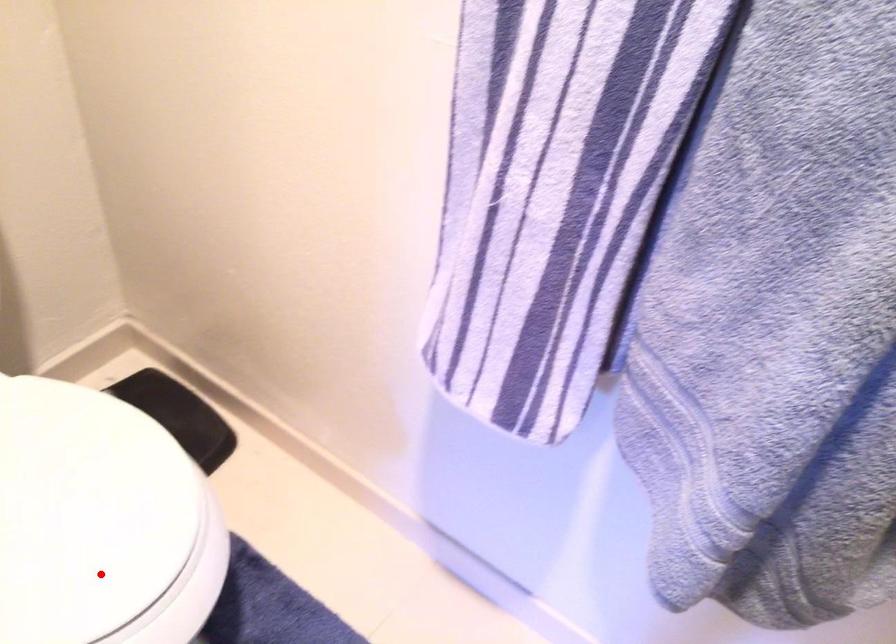
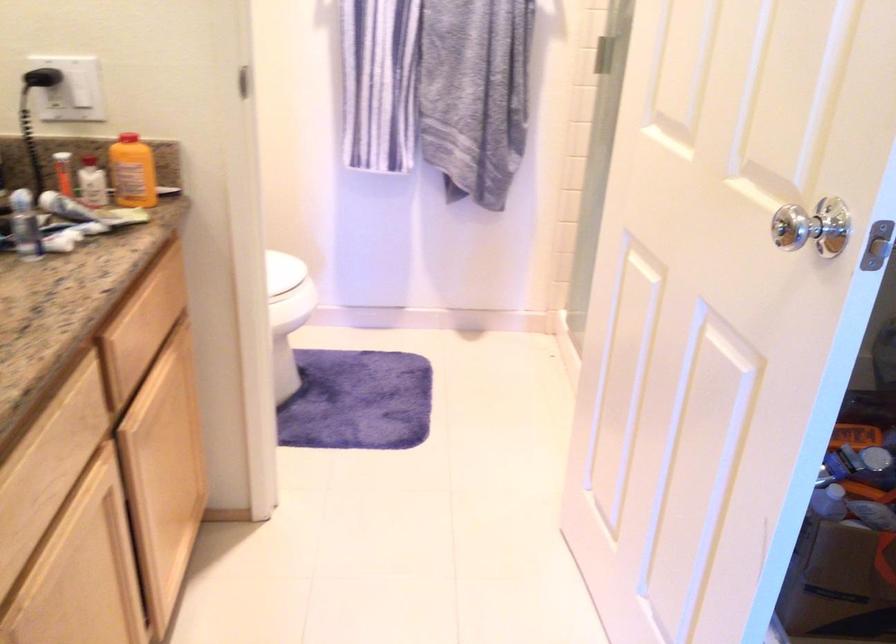
Question: I am providing you with two images of the same scene from different viewpoints. Given a red point in image1, look at the same physical point in image2. Is it:

Choices:
 (A) Closer to the viewpoint
 (B) Farther from the viewpoint

Answer: (B)